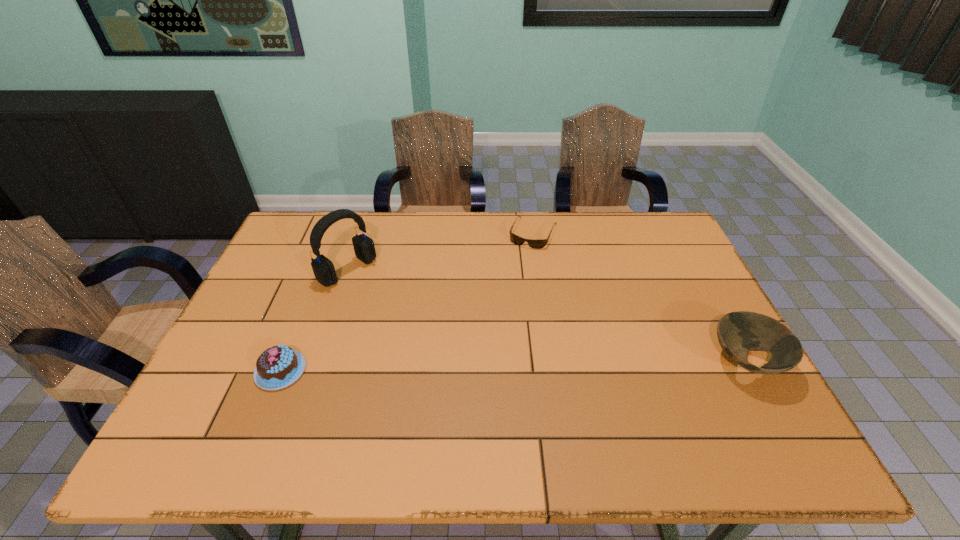
I want to click on free space on the desktop that is between the second shortest object and the third shortest object and is positioned on the front-facing side of the farthest object, so click(470, 367).

Image resolution: width=960 pixels, height=540 pixels. Find the location of `vacant spot on the desktop that is between the chocolate cake and the rightmost object and is positioned on the headband of the tallest object`. vacant spot on the desktop that is between the chocolate cake and the rightmost object and is positioned on the headband of the tallest object is located at coordinates (477, 367).